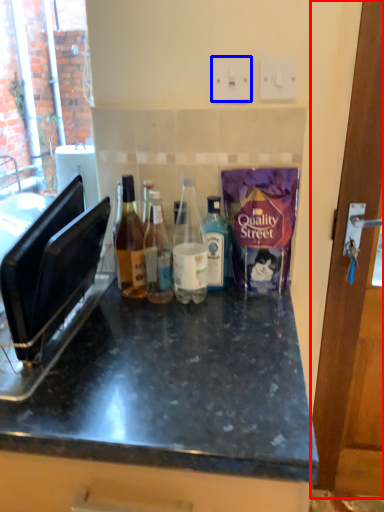
Question: Among these objects, which one is farthest to the camera, door (highlighted by a red box) or electric outlet (highlighted by a blue box)?

Choices:
 (A) door
 (B) electric outlet

Answer: (B)